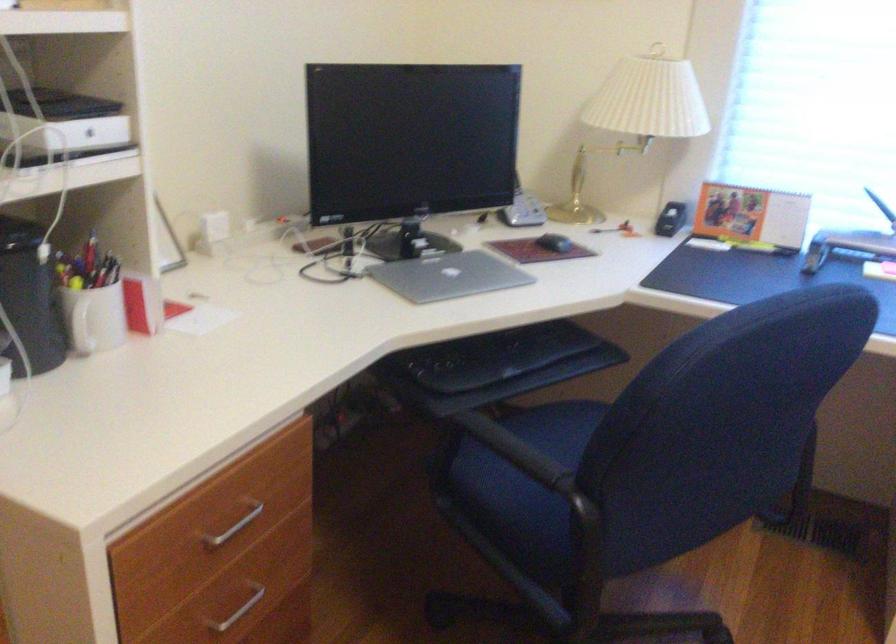
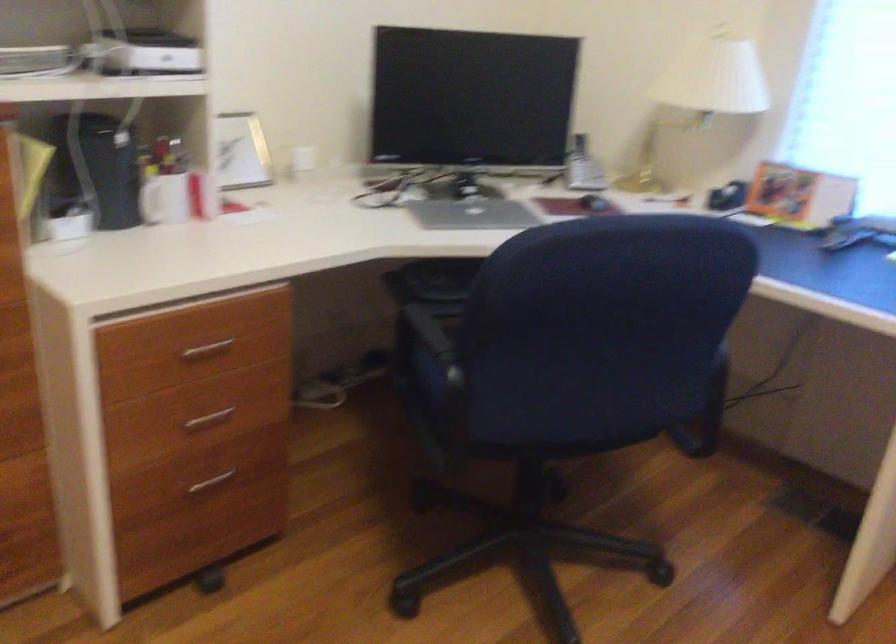
Which direction would the cameraman need to move to produce the second image?

The movement direction of the cameraman is right, backward.